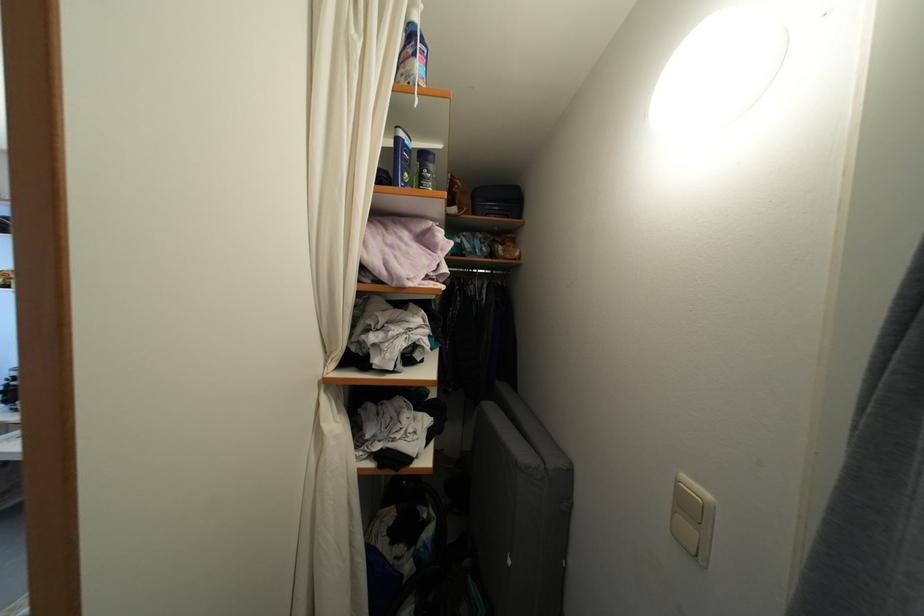
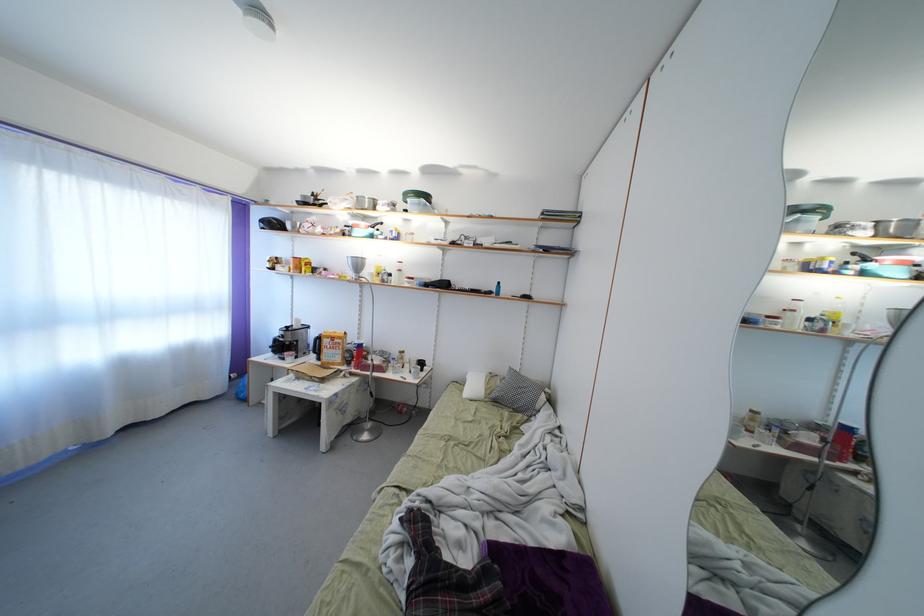
Question: How did the camera likely rotate?

Choices:
 (A) Left
 (B) Right
 (C) Up
 (D) Down

Answer: (A)